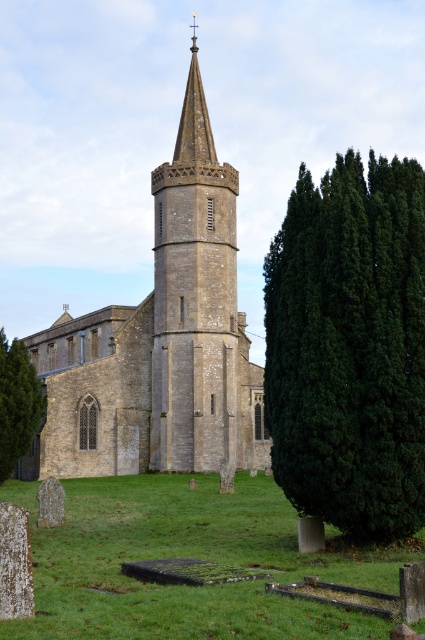
Question: Which object is farther from the camera taking this photo?

Choices:
 (A) white textured stone gravestone at lower left
 (B) green grass at lower center
 (C) stone church at center
 (D) green textured tree at center right

Answer: (C)

Question: Is green textured tree at center right thinner than white textured stone gravestone at lower left?

Choices:
 (A) no
 (B) yes

Answer: (A)

Question: Is green textured tree at lower left wider than white textured stone gravestone at lower left?

Choices:
 (A) no
 (B) yes

Answer: (B)

Question: Can you confirm if green grass at lower center is positioned above white textured stone gravestone at lower left?

Choices:
 (A) yes
 (B) no

Answer: (B)

Question: Which point is closer to the camera?

Choices:
 (A) [x=11, y=525]
 (B) [x=166, y=352]

Answer: (A)

Question: Considering the real-world distances, which object is farthest from the green textured tree at center right?

Choices:
 (A) green grass at lower center
 (B) white textured stone gravestone at lower left
 (C) stone church at center

Answer: (C)